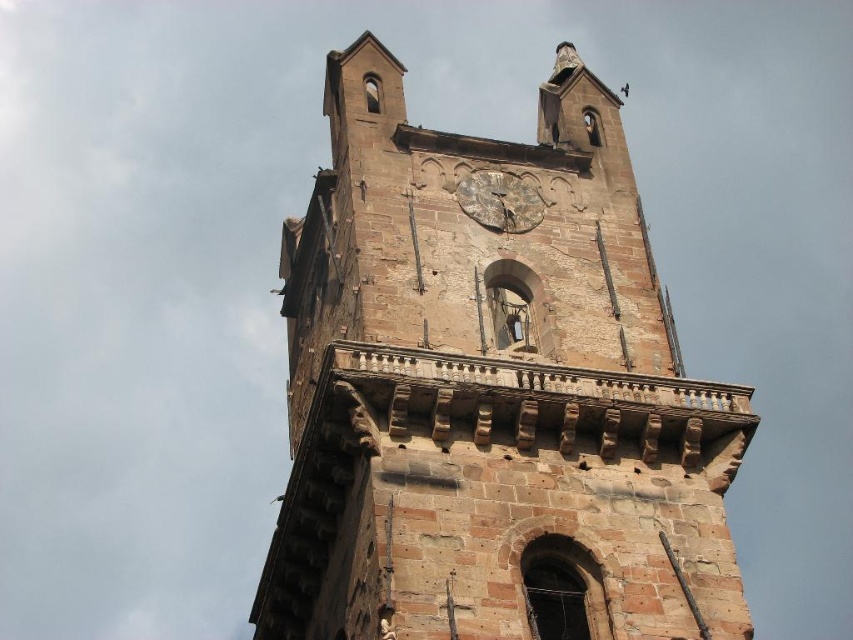
Is point (577, 115) positioned before point (486, 188)?

No, (577, 115) is behind (486, 188).

Is brown stone clock tower at center above rusty metal clock at center?

Correct, brown stone clock tower at center is located above rusty metal clock at center.

The width and height of the screenshot is (853, 640). What do you see at coordinates (491, 394) in the screenshot?
I see `brown stone clock tower at center` at bounding box center [491, 394].

Locate an element on the screen. The width and height of the screenshot is (853, 640). brown stone clock tower at center is located at coordinates (491, 394).